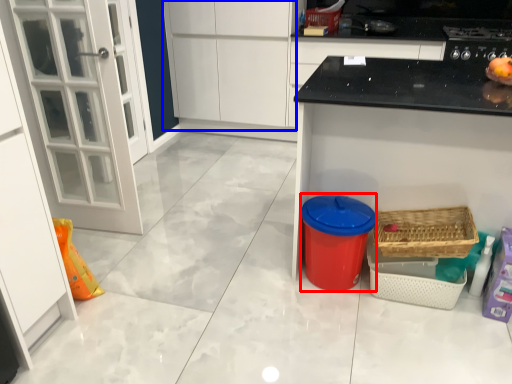
Question: Which object appears farthest to the camera in this image, appliance (highlighted by a red box) or cabinetry (highlighted by a blue box)?

Choices:
 (A) appliance
 (B) cabinetry

Answer: (B)